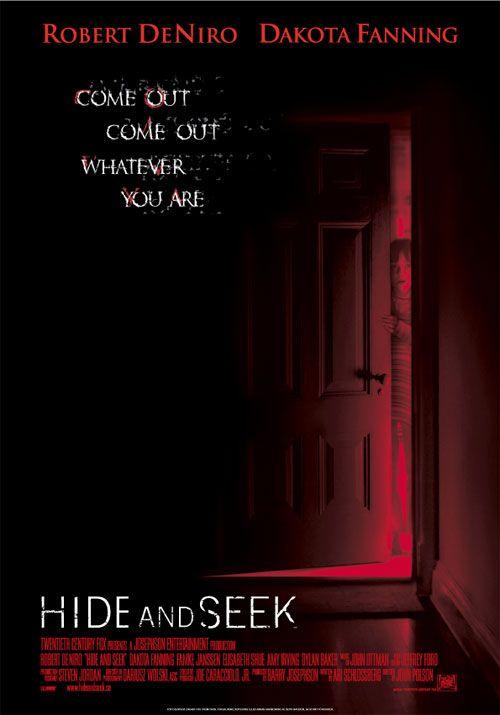
This screenshot has width=500, height=715. Identify the location of walll. (486, 482).